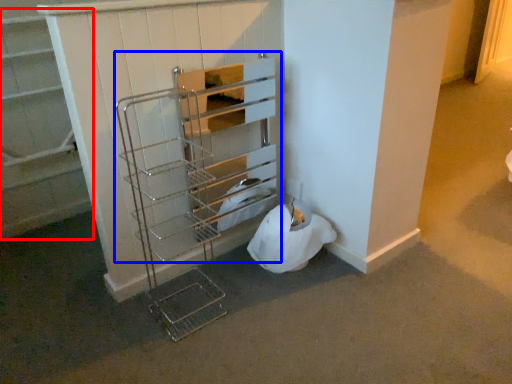
Question: Which point is further to the camera, shelf (highlighted by a red box) or shelf (highlighted by a blue box)?

Choices:
 (A) shelf
 (B) shelf

Answer: (A)